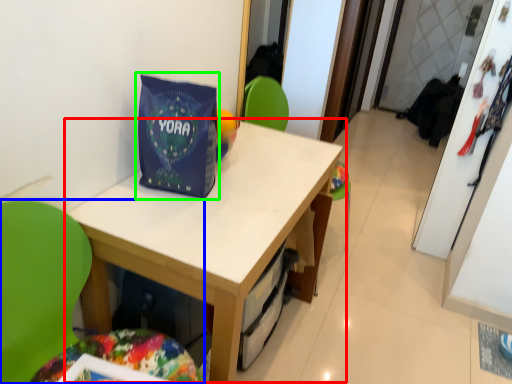
Question: Which is farther away from table (highlighted by a red box)? chair (highlighted by a blue box) or gift bag (highlighted by a green box)?

Choices:
 (A) chair
 (B) gift bag

Answer: (A)